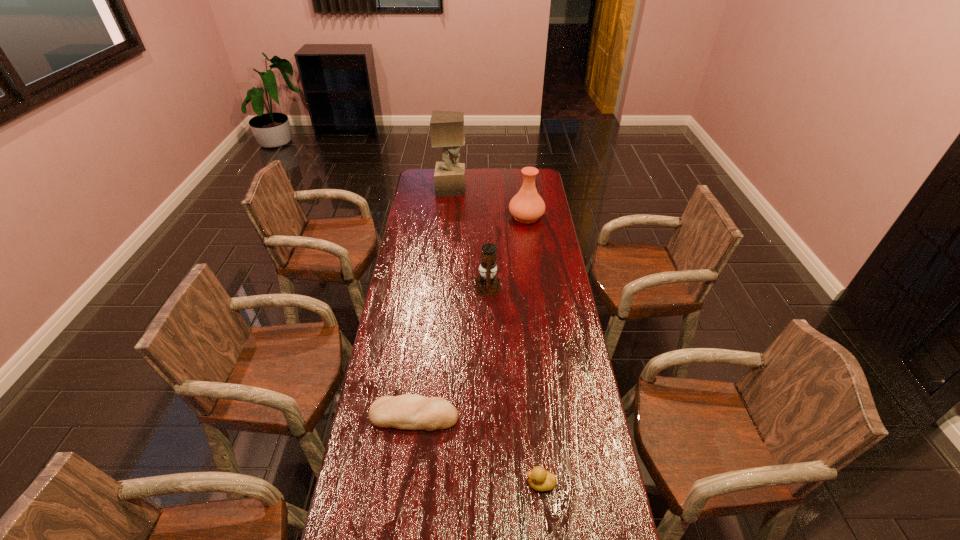
In order to click on free space located on the front of the vase in this screenshot , I will do `click(535, 279)`.

I want to click on vacant area situated on the side of the lantern, there is a wick adjustment knob, so click(422, 287).

Find the location of a particular element. This screenshot has width=960, height=540. vacant region located on the side of the lantern, there is a wick adjustment knob is located at coordinates (456, 287).

Identify the location of vacant space located on the side of the lantern, there is a wick adjustment knob. This screenshot has height=540, width=960. (430, 287).

Locate an element on the screen. Image resolution: width=960 pixels, height=540 pixels. vacant space located 0.360m on the face of the fourth tallest object is located at coordinates (399, 484).

What are the coordinates of `vacant point located on the face of the fourth tallest object` in the screenshot? It's located at (491, 484).

Locate an element on the screen. This screenshot has height=540, width=960. free space located on the face of the fourth tallest object is located at coordinates (406, 484).

The height and width of the screenshot is (540, 960). In order to click on vacant space located 0.290m on the back of the fourth farthest object in this screenshot , I will do `click(424, 333)`.

What are the coordinates of `object at the far edge` in the screenshot? It's located at (447, 127).

Find the location of a particular element. sculpture positioned at the left edge is located at coordinates (447, 127).